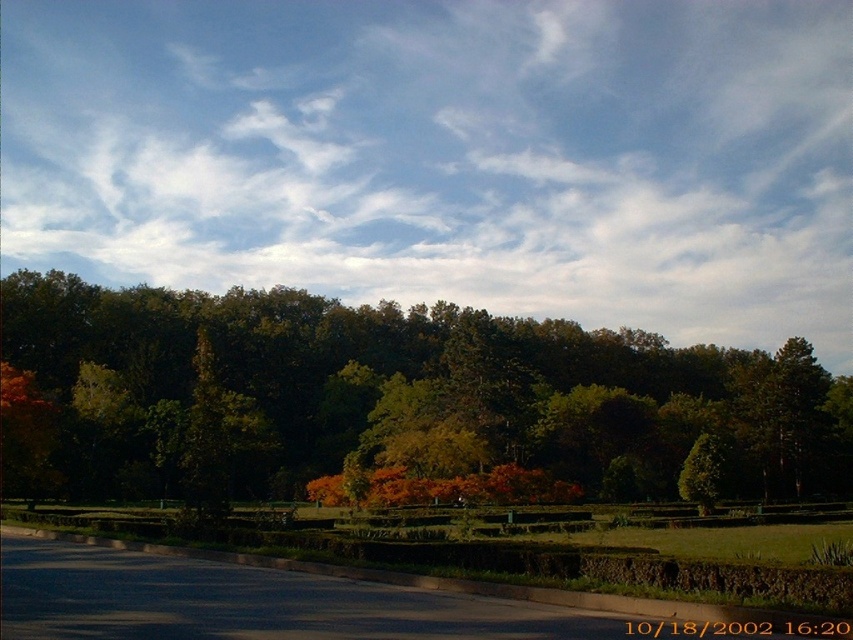
Can you confirm if white fluffy cloud at upper center is positioned to the right of green leafy tree at center?

In fact, white fluffy cloud at upper center is to the left of green leafy tree at center.

Is white fluffy cloud at upper center closer to the viewer compared to green leafy tree at center?

That is False.

Measure the distance between point (659, 61) and camera.

A distance of 1015.47 feet exists between point (659, 61) and camera.

At what (x,y) coordinates should I click in order to perform the action: click on white fluffy cloud at upper center. Please return your answer as a coordinate pair (x, y). This screenshot has height=640, width=853. Looking at the image, I should click on (447, 154).